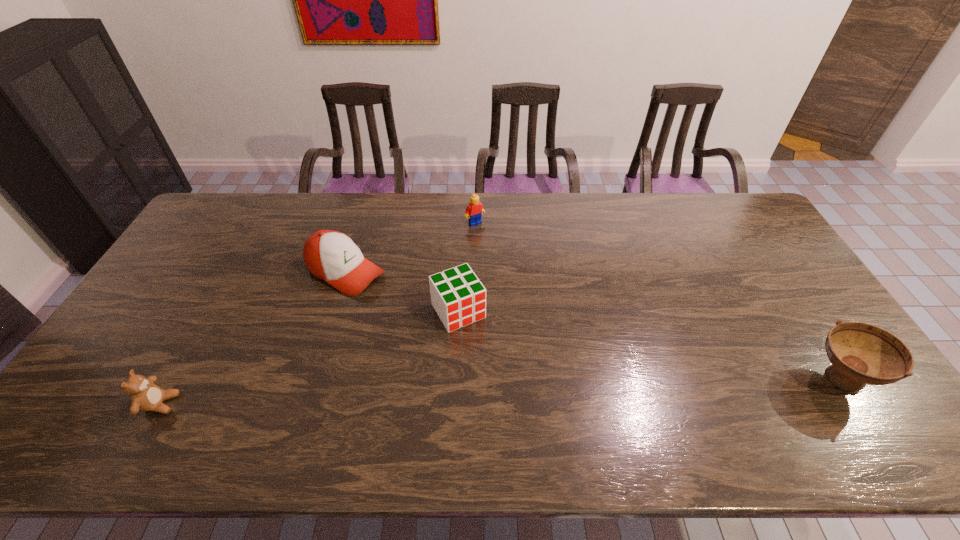
Locate an element on the screen. The height and width of the screenshot is (540, 960). vacant space on the desktop that is between the teddy bear and the rightmost object and is positioned on the face of the Lego is located at coordinates (602, 387).

At what (x,y) coordinates should I click in order to perform the action: click on free space on the desktop that is between the leftmost object and the rightmost object and is positioned on the red face of the cube. Please return your answer as a coordinate pair (x, y). The height and width of the screenshot is (540, 960). Looking at the image, I should click on (508, 390).

The image size is (960, 540). I want to click on vacant space on the desktop that is between the teddy bear and the soup bowl and is positioned on the front-facing side of the second object from left to right, so click(x=563, y=388).